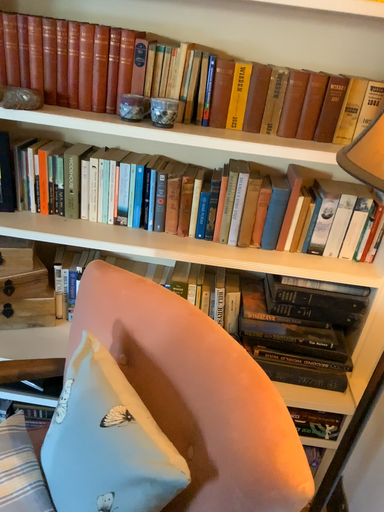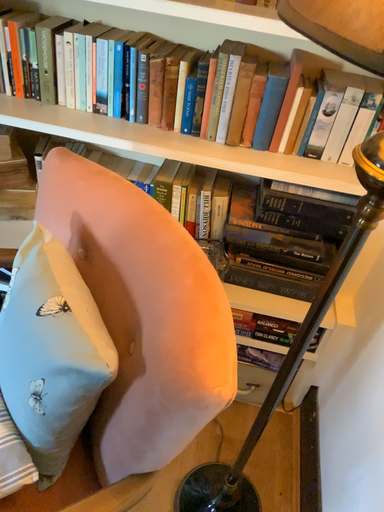
Question: How did the camera likely rotate when shooting the video?

Choices:
 (A) rotated downward
 (B) rotated upward

Answer: (A)